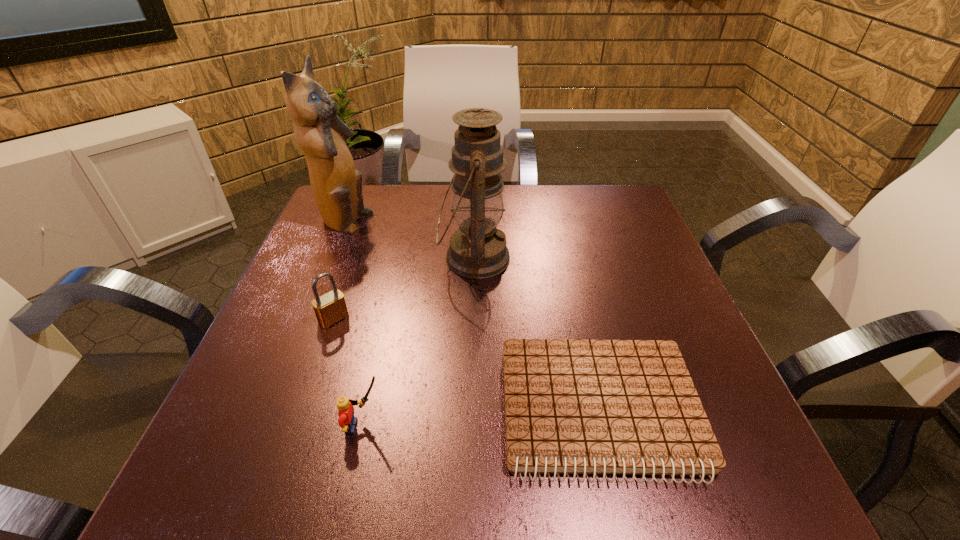
At what (x,y) coordinates should I click in order to perform the action: click on free space at the right edge. Please return your answer as a coordinate pair (x, y). The height and width of the screenshot is (540, 960). Looking at the image, I should click on (734, 404).

In the image, there is a desktop. Identify the location of free space at the far left corner. The width and height of the screenshot is (960, 540). pyautogui.click(x=380, y=193).

Where is `free region at the far right corner`? This screenshot has width=960, height=540. free region at the far right corner is located at coordinates (582, 199).

Image resolution: width=960 pixels, height=540 pixels. What are the coordinates of `vacant area that lies between the cat and the padlock` in the screenshot? It's located at click(x=339, y=271).

This screenshot has height=540, width=960. I want to click on free point between the third nearest object and the notebook, so click(x=467, y=364).

Find the location of a particular element. The height and width of the screenshot is (540, 960). vacant space that's between the oil lamp and the third farthest object is located at coordinates (404, 288).

Where is `vacant area that lies between the notebook and the oil lamp`? This screenshot has width=960, height=540. vacant area that lies between the notebook and the oil lamp is located at coordinates point(537,334).

At what (x,y) coordinates should I click in order to perform the action: click on unoccupied position between the Lego and the third farthest object. Please return your answer as a coordinate pair (x, y). Looking at the image, I should click on (348, 373).

Identify the location of free point between the notebook and the cat. The height and width of the screenshot is (540, 960). click(x=472, y=317).

This screenshot has width=960, height=540. Find the location of `blank region between the padlock and the notebook`. blank region between the padlock and the notebook is located at coordinates (467, 364).